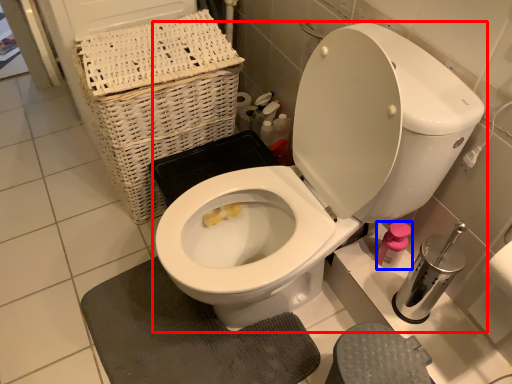
Question: Among these objects, which one is nearest to the camera, toilet (highlighted by a red box) or toiletry (highlighted by a blue box)?

Choices:
 (A) toilet
 (B) toiletry

Answer: (A)